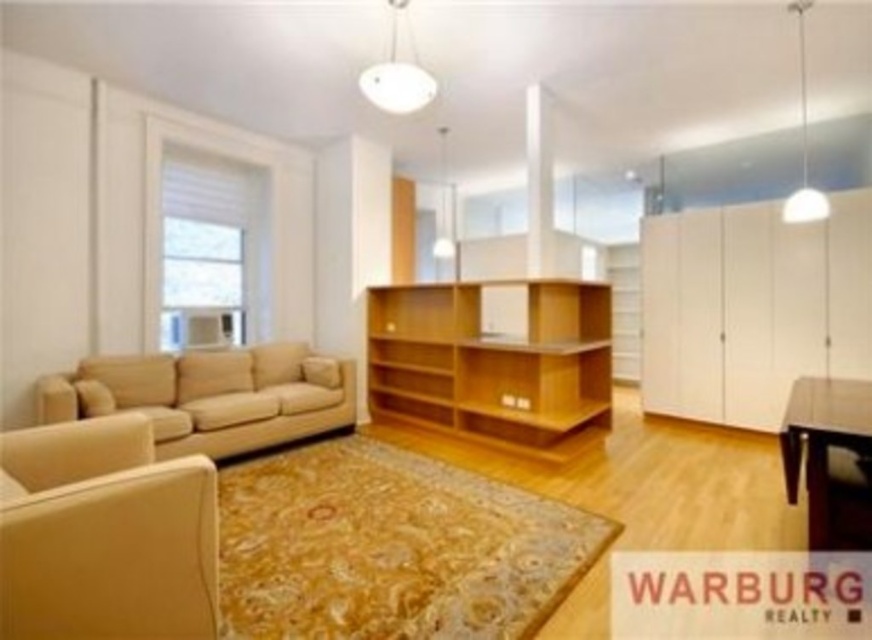
You are planning to rearrange the living room and want to place a new coffee table that is 1.2 meters wide. The beige fabric couch at lower left and the dark brown wooden table at lower right are in the way. Can the new coffee table fit between them?

The beige fabric couch at lower left is larger than the dark brown wooden table at lower right. However, without knowing the exact distance between them, it is impossible to determine if the new coffee table will fit.

You are a guest entering the living room and want to sit down. Which object, the beige fabric couch at lower left or the dark brown wooden table at lower right, is closer to you?

The beige fabric couch at lower left is closer to you because it is positioned over the dark brown wooden table at lower right, indicating it is in front and nearer to your viewpoint.